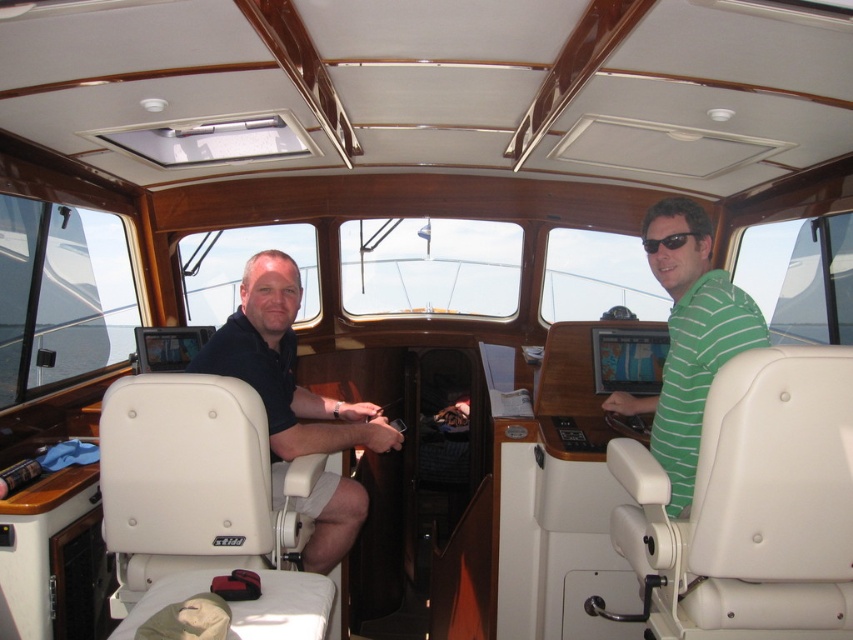
Who is more forward, (135, 493) or (318, 493)?

Point (135, 493) is in front.

Which is more to the left, white leather seat at center or dark blue shirt at left?

Positioned to the left is white leather seat at center.

Locate an element on the screen. white leather seat at center is located at coordinates (189, 483).

Where is `white leather seat at center`? white leather seat at center is located at coordinates (189, 483).

Is white leather seat at center wider than green striped shirt at right?

Yes.

Between point (263, 424) and point (759, 316), which one is positioned in front?

Positioned in front is point (759, 316).

Locate an element on the screen. Image resolution: width=853 pixels, height=640 pixels. white leather seat at center is located at coordinates (189, 483).

Does point (108, 496) come closer to viewer compared to point (693, 236)?

That is True.

From the picture: Between white leather seat at center and black plastic sunglasses at center, which one is positioned lower?

white leather seat at center

Is point (187, 406) positioned in front of point (672, 248)?

Yes, it is.

In order to click on white leather seat at center in this screenshot , I will do `click(189, 483)`.